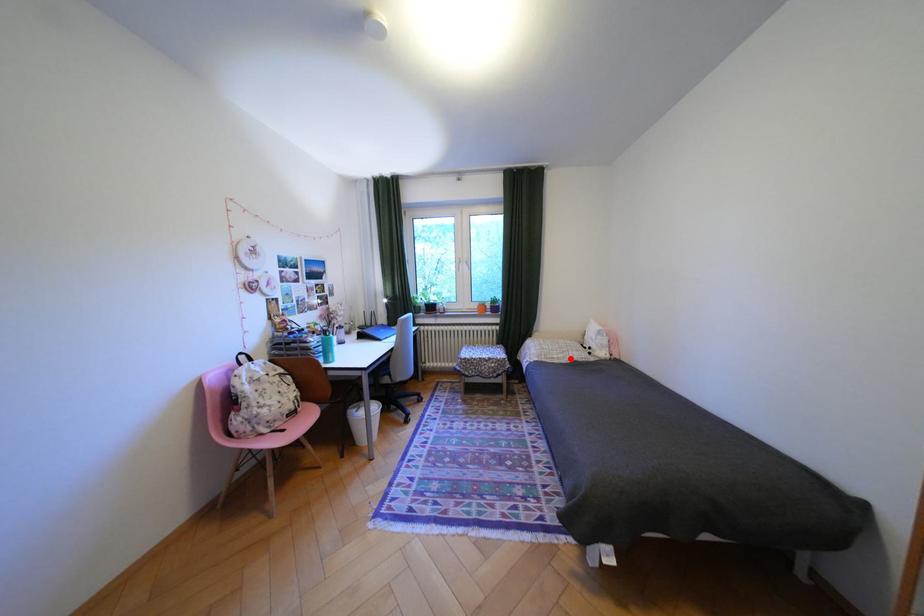
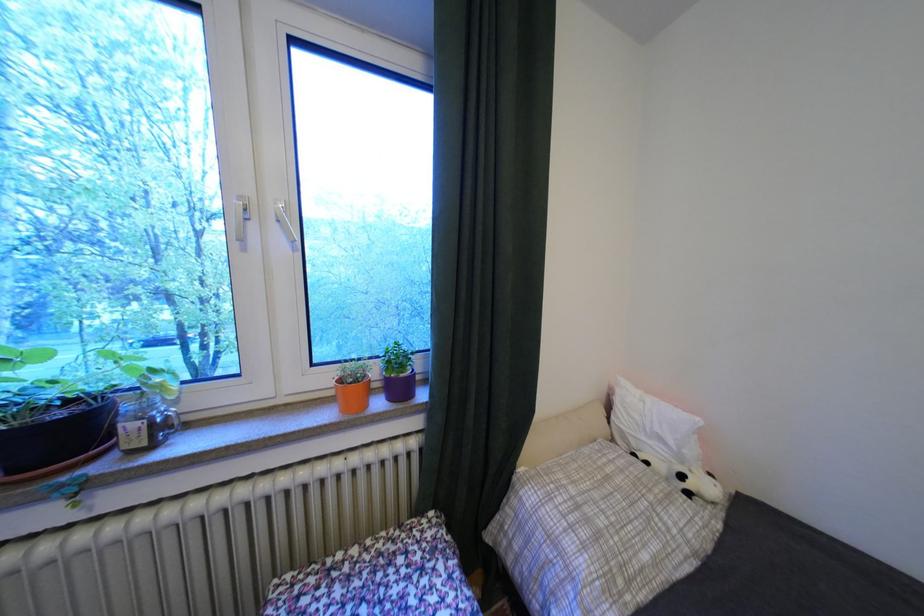
Question: I am providing you with two images of the same scene from different viewpoints. A red point is shown in image1. For the corresponding object point in image2, is it positioned nearer or farther from the camera?

Choices:
 (A) Nearer
 (B) Farther

Answer: (A)